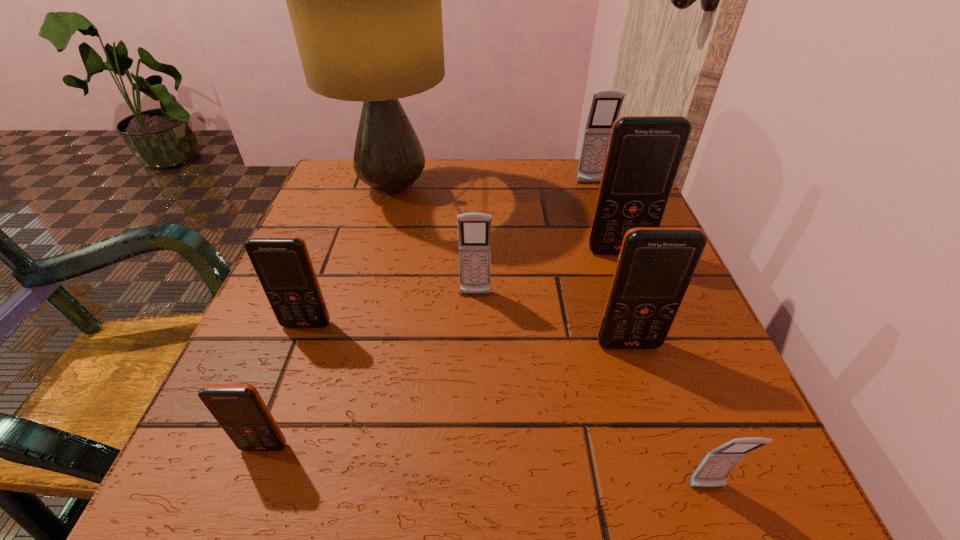
Image resolution: width=960 pixels, height=540 pixels. I want to click on the third nearest orange cellular telephone, so click(x=282, y=263).

In order to click on the third biggest orange cellular telephone in this screenshot , I will do `click(282, 263)`.

The width and height of the screenshot is (960, 540). I want to click on the nearest orange cellular telephone, so click(x=239, y=409).

Locate an element on the screen. This screenshot has width=960, height=540. the smallest orange cellular telephone is located at coordinates (239, 409).

At what (x,y) coordinates should I click in order to perform the action: click on the nearest object. Please return your answer as a coordinate pair (x, y). Looking at the image, I should click on coord(713,470).

This screenshot has width=960, height=540. Identify the location of the nearest cellular telephone. (713, 470).

Identify the location of vacant space situated 0.060m on the front of the lampshade. This screenshot has width=960, height=540. (380, 238).

Where is `vacant space located on the screen of the farthest orange cellular telephone`? The height and width of the screenshot is (540, 960). vacant space located on the screen of the farthest orange cellular telephone is located at coordinates (685, 437).

Locate an element on the screen. The height and width of the screenshot is (540, 960). free location located on the front-facing side of the farthest cellular telephone is located at coordinates (610, 236).

Locate an element on the screen. This screenshot has width=960, height=540. blank space located on the screen of the third farthest orange cellular telephone is located at coordinates (677, 500).